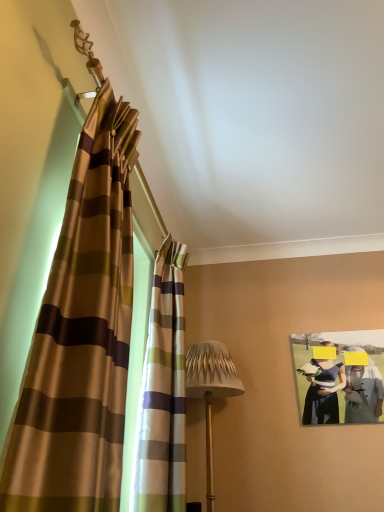
What do you see at coordinates (211, 391) in the screenshot? I see `textured beige lampshade at center` at bounding box center [211, 391].

Identify the location of silky brown striped curtain at left, the 1th curtain from the front. The width and height of the screenshot is (384, 512). (80, 336).

What do you see at coordinates (340, 376) in the screenshot? I see `matte paper photo frame at upper right` at bounding box center [340, 376].

The image size is (384, 512). I want to click on textured beige lampshade at center, so click(211, 391).

In the image, there is a silky brown striped curtain at left, the second curtain viewed from the back. Where is `picture frame below it (from the image's perspective)`? Image resolution: width=384 pixels, height=512 pixels. picture frame below it (from the image's perspective) is located at coordinates (340, 376).

From a real-world perspective, is matte paper photo frame at upper right over silky brown striped curtain at left, the 1th curtain from the front?

Yes, from a real-world perspective, matte paper photo frame at upper right is on top of silky brown striped curtain at left, the 1th curtain from the front.

Considering the relative positions of matte paper photo frame at upper right and silky brown striped curtain at left, the 1th curtain from the front, in the image provided, is matte paper photo frame at upper right to the left of silky brown striped curtain at left, the 1th curtain from the front, from the viewer's perspective?

No, matte paper photo frame at upper right is not to the left of silky brown striped curtain at left, the 1th curtain from the front.

In the scene shown: Which object is closer to the camera taking this photo, matte paper photo frame at upper right or silky brown striped curtain at left, the second curtain viewed from the back?

silky brown striped curtain at left, the second curtain viewed from the back, is in front.

Considering the relative positions of textured beige lampshade at center and silky brown striped curtain at left, the second curtain viewed from the back, in the image provided, is textured beige lampshade at center in front of silky brown striped curtain at left, the second curtain viewed from the back,?

No, it is behind silky brown striped curtain at left, the second curtain viewed from the back.

Looking at their sizes, would you say textured beige lampshade at center is wider or thinner than silky brown striped curtain at left, the 1th curtain from the front?

Considering their sizes, textured beige lampshade at center looks broader than silky brown striped curtain at left, the 1th curtain from the front.

You are a GUI agent. You are given a task and a screenshot of the screen. Output one action in this format:
    pyautogui.click(x=<x>, y=<y>)
    Task: Click on the table lamp on the right of silky brown striped curtain at left, the second curtain viewed from the back
    
    Given the screenshot: What is the action you would take?
    pyautogui.click(x=211, y=391)

Considering the sizes of textured beige lampshade at center and silky brown striped curtain at left, the 1th curtain from the front, in the image, is textured beige lampshade at center bigger or smaller than silky brown striped curtain at left, the 1th curtain from the front,?

textured beige lampshade at center is bigger than silky brown striped curtain at left, the 1th curtain from the front.

From the image's perspective, is striped fabric curtain at left, which is the 2th curtain in front-to-back order, on top of matte paper photo frame at upper right?

Yes, from the image's perspective, striped fabric curtain at left, which is the 2th curtain in front-to-back order, is over matte paper photo frame at upper right.

Is point (161, 504) positioned behind point (357, 422)?

No, (161, 504) is in front of (357, 422).

Is striped fabric curtain at left, which is the first curtain from back to front, smaller than matte paper photo frame at upper right?

No, striped fabric curtain at left, which is the first curtain from back to front, is not smaller than matte paper photo frame at upper right.

Are striped fabric curtain at left, which is the first curtain from back to front, and matte paper photo frame at upper right located far from each other?

Yes, striped fabric curtain at left, which is the first curtain from back to front, and matte paper photo frame at upper right are quite far apart.

From a real-world perspective, is silky brown striped curtain at left, the second curtain viewed from the back, physically below striped fabric curtain at left, which is the first curtain from back to front?

Incorrect, from a real-world perspective, silky brown striped curtain at left, the second curtain viewed from the back, is higher than striped fabric curtain at left, which is the first curtain from back to front.

What's the angular difference between silky brown striped curtain at left, the 1th curtain from the front, and striped fabric curtain at left, which is the 2th curtain in front-to-back order,'s facing directions?

2.82 degrees separate the facing orientations of silky brown striped curtain at left, the 1th curtain from the front, and striped fabric curtain at left, which is the 2th curtain in front-to-back order.

Is striped fabric curtain at left, which is the first curtain from back to front, located within silky brown striped curtain at left, the second curtain viewed from the back?

Definitely not — striped fabric curtain at left, which is the first curtain from back to front, is not inside silky brown striped curtain at left, the second curtain viewed from the back.

Find the location of a particular element. This screenshot has height=512, width=384. the 1st curtain above the textured beige lampshade at center (from a real-world perspective) is located at coordinates (x=163, y=392).

Is textured beige lampshade at center wider than striped fabric curtain at left, which is the first curtain from back to front?

Correct, the width of textured beige lampshade at center exceeds that of striped fabric curtain at left, which is the first curtain from back to front.

Looking at this image, in terms of height, does textured beige lampshade at center look taller or shorter compared to striped fabric curtain at left, which is the 2th curtain in front-to-back order?

textured beige lampshade at center is shorter than striped fabric curtain at left, which is the 2th curtain in front-to-back order.

Considering the relative positions of striped fabric curtain at left, which is the 2th curtain in front-to-back order, and silky brown striped curtain at left, the second curtain viewed from the back, in the image provided, is striped fabric curtain at left, which is the 2th curtain in front-to-back order, behind silky brown striped curtain at left, the second curtain viewed from the back,?

Yes.

From a real-world perspective, which object rests below the other?

striped fabric curtain at left, which is the first curtain from back to front, from a real-world perspective.

How many degrees apart are the facing directions of striped fabric curtain at left, which is the first curtain from back to front, and silky brown striped curtain at left, the second curtain viewed from the back?

The angular difference between striped fabric curtain at left, which is the first curtain from back to front, and silky brown striped curtain at left, the second curtain viewed from the back, is 2.82 degrees.

Is striped fabric curtain at left, which is the first curtain from back to front, not inside silky brown striped curtain at left, the second curtain viewed from the back?

striped fabric curtain at left, which is the first curtain from back to front, lies outside silky brown striped curtain at left, the second curtain viewed from the back,'s area.

Considering the positions of objects silky brown striped curtain at left, the 1th curtain from the front, and matte paper photo frame at upper right in the image provided, who is behind, silky brown striped curtain at left, the 1th curtain from the front, or matte paper photo frame at upper right?

matte paper photo frame at upper right is further away from the camera.

Does silky brown striped curtain at left, the second curtain viewed from the back, have a lesser width compared to matte paper photo frame at upper right?

No.

From the image's perspective, is silky brown striped curtain at left, the second curtain viewed from the back, above or below matte paper photo frame at upper right?

Based on their image positions, silky brown striped curtain at left, the second curtain viewed from the back, is located above matte paper photo frame at upper right.

Find the location of a particular element. The width and height of the screenshot is (384, 512). picture frame lying behind the silky brown striped curtain at left, the 1th curtain from the front is located at coordinates (340, 376).

Identify the location of picture frame on the right of silky brown striped curtain at left, the 1th curtain from the front. (340, 376).

In the image, there is a silky brown striped curtain at left, the 1th curtain from the front. At what (x,y) coordinates should I click in order to perform the action: click on table lamp below it (from a real-world perspective). Please return your answer as a coordinate pair (x, y). Image resolution: width=384 pixels, height=512 pixels. Looking at the image, I should click on (211, 391).

From the image, which object appears to be farther from textured beige lampshade at center, matte paper photo frame at upper right or silky brown striped curtain at left, the second curtain viewed from the back?

silky brown striped curtain at left, the second curtain viewed from the back.

From the image, which object appears to be nearer to striped fabric curtain at left, which is the 2th curtain in front-to-back order, matte paper photo frame at upper right or silky brown striped curtain at left, the second curtain viewed from the back?

Among the two, silky brown striped curtain at left, the second curtain viewed from the back, is located nearer to striped fabric curtain at left, which is the 2th curtain in front-to-back order.

Looking at the image, which one is located closer to silky brown striped curtain at left, the 1th curtain from the front, striped fabric curtain at left, which is the first curtain from back to front, or textured beige lampshade at center?

striped fabric curtain at left, which is the first curtain from back to front, is positioned closer to the anchor silky brown striped curtain at left, the 1th curtain from the front.

Based on their spatial positions, is matte paper photo frame at upper right or textured beige lampshade at center closer to striped fabric curtain at left, which is the 2th curtain in front-to-back order?

Among the two, textured beige lampshade at center is located nearer to striped fabric curtain at left, which is the 2th curtain in front-to-back order.

Estimate the real-world distances between objects in this image. Which object is further from silky brown striped curtain at left, the second curtain viewed from the back, textured beige lampshade at center or matte paper photo frame at upper right?

Based on the image, matte paper photo frame at upper right appears to be further to silky brown striped curtain at left, the second curtain viewed from the back.

When comparing their distances from silky brown striped curtain at left, the second curtain viewed from the back, does matte paper photo frame at upper right or textured beige lampshade at center seem closer?

textured beige lampshade at center is closer to silky brown striped curtain at left, the second curtain viewed from the back.

From the image, which object appears to be farther from textured beige lampshade at center, striped fabric curtain at left, which is the 2th curtain in front-to-back order, or silky brown striped curtain at left, the 1th curtain from the front?

silky brown striped curtain at left, the 1th curtain from the front, lies further to textured beige lampshade at center than the other object.

Which object lies nearer to the anchor point textured beige lampshade at center, striped fabric curtain at left, which is the 2th curtain in front-to-back order, or matte paper photo frame at upper right?

The object closer to textured beige lampshade at center is striped fabric curtain at left, which is the 2th curtain in front-to-back order.

Where is `table lamp between silky brown striped curtain at left, the 1th curtain from the front, and matte paper photo frame at upper right in the front-back direction`? The image size is (384, 512). table lamp between silky brown striped curtain at left, the 1th curtain from the front, and matte paper photo frame at upper right in the front-back direction is located at coordinates (211, 391).

In order to click on curtain between silky brown striped curtain at left, the 1th curtain from the front, and matte paper photo frame at upper right from front to back in this screenshot , I will do `click(163, 392)`.

The width and height of the screenshot is (384, 512). In order to click on table lamp between striped fabric curtain at left, which is the first curtain from back to front, and matte paper photo frame at upper right in this screenshot , I will do `click(211, 391)`.

Where is `curtain between silky brown striped curtain at left, the second curtain viewed from the back, and textured beige lampshade at center in the front-back direction`? This screenshot has width=384, height=512. curtain between silky brown striped curtain at left, the second curtain viewed from the back, and textured beige lampshade at center in the front-back direction is located at coordinates (163, 392).